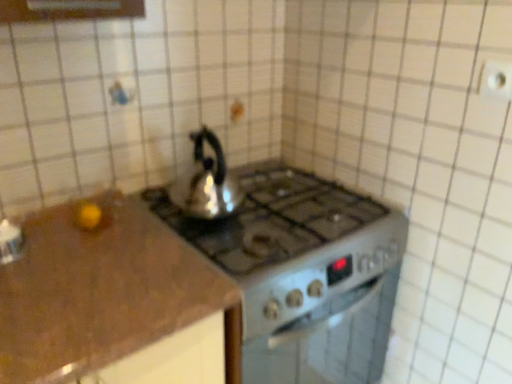
The height and width of the screenshot is (384, 512). In order to click on vacant space situated on the left part of shiny metallic kettle at center in this screenshot , I will do `click(160, 206)`.